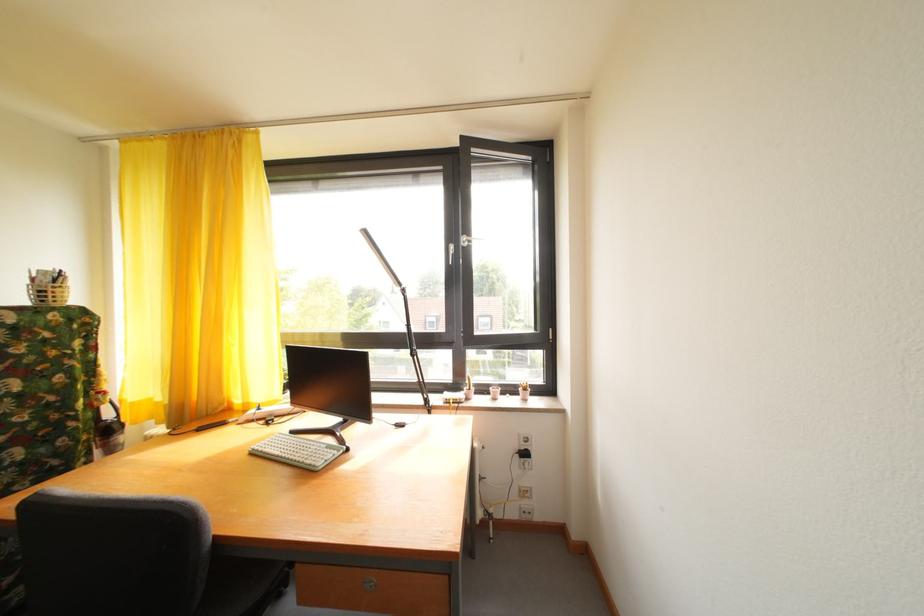
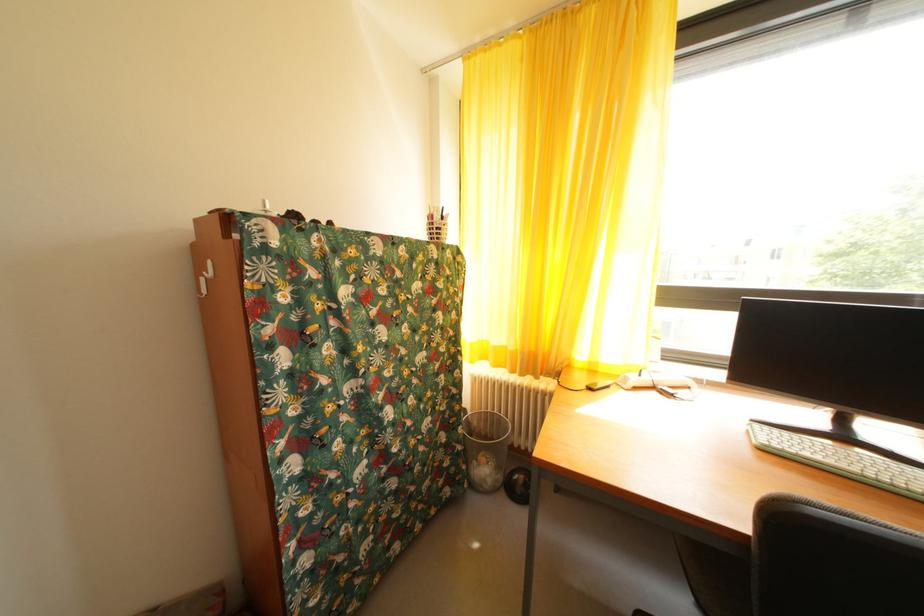
In the second image, find the point that corresponds to (43,286) in the first image.

(440, 223)